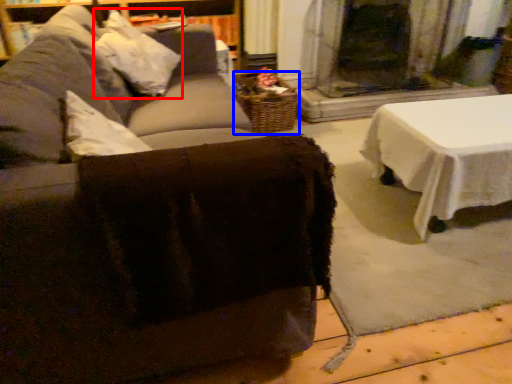
Question: Among these objects, which one is farthest to the camera, pillow (highlighted by a red box) or basket (highlighted by a blue box)?

Choices:
 (A) pillow
 (B) basket

Answer: (B)